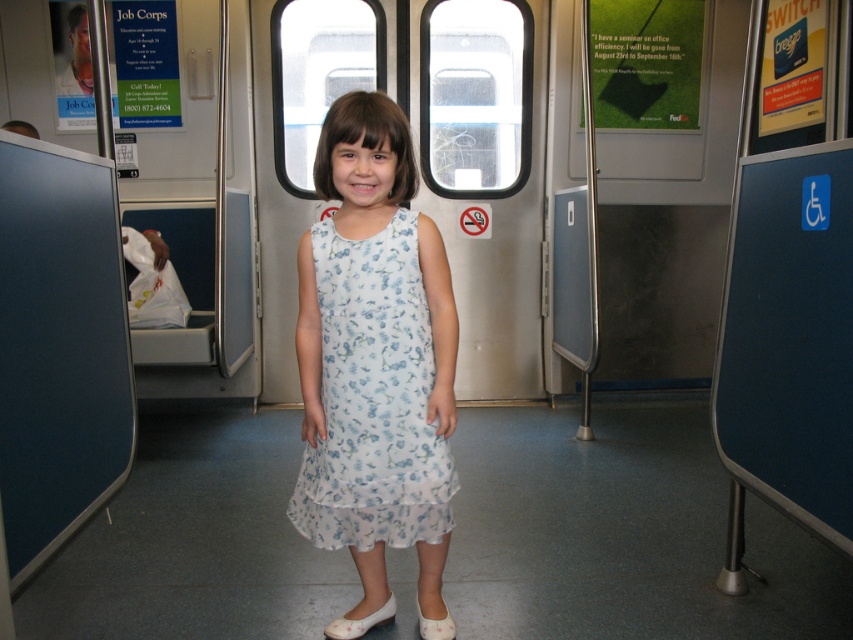
Does white floral dress at center appear on the right side of white satin shoe at lower center?

Correct, you'll find white floral dress at center to the right of white satin shoe at lower center.

Based on the photo, is white floral dress at center below white satin shoe at lower center?

Incorrect, white floral dress at center is not positioned below white satin shoe at lower center.

Which is in front, point (433, 516) or point (381, 616)?

Point (433, 516) is more forward.

Where is `white floral dress at center`? The height and width of the screenshot is (640, 853). white floral dress at center is located at coordinates (373, 397).

Can you confirm if white satin shoe at lower center is positioned below white fabric shoe at lower center?

Correct, white satin shoe at lower center is located below white fabric shoe at lower center.

From the picture: Does white satin shoe at lower center come in front of white fabric shoe at lower center?

No, white satin shoe at lower center is further to the viewer.

Who is more distant from viewer, (373, 620) or (445, 632)?

The point (373, 620) is behind.

This screenshot has height=640, width=853. I want to click on white satin shoe at lower center, so click(360, 621).

Does white floral dress at center come in front of white fabric shoe at lower center?

Yes, it is.

Is white floral dress at center wider than white fabric shoe at lower center?

Yes, white floral dress at center is wider than white fabric shoe at lower center.

The image size is (853, 640). What do you see at coordinates (373, 397) in the screenshot?
I see `white floral dress at center` at bounding box center [373, 397].

Where is `white floral dress at center`? The height and width of the screenshot is (640, 853). white floral dress at center is located at coordinates (373, 397).